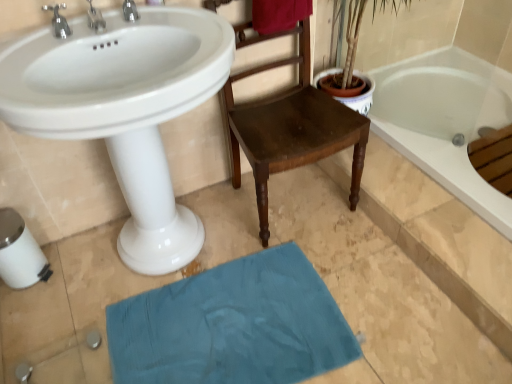
Question: Does silver metallic faucet at upper left, the second tap from the left, lie in front of teal fabric bath mat at lower center?

Choices:
 (A) no
 (B) yes

Answer: (B)

Question: Is silver metallic faucet at upper left, the second tap in the right-to-left sequence, aimed at teal fabric bath mat at lower center?

Choices:
 (A) no
 (B) yes

Answer: (A)

Question: Does silver metallic faucet at upper left, the second tap in the right-to-left sequence, touch teal fabric bath mat at lower center?

Choices:
 (A) no
 (B) yes

Answer: (A)

Question: Is silver metallic faucet at upper left, the second tap in the right-to-left sequence, positioned behind teal fabric bath mat at lower center?

Choices:
 (A) yes
 (B) no

Answer: (B)

Question: From a real-world perspective, is silver metallic faucet at upper left, the second tap from the left, positioned over teal fabric bath mat at lower center based on gravity?

Choices:
 (A) yes
 (B) no

Answer: (A)

Question: Visually, is white plastic toilet paper at lower left positioned to the left or to the right of teal fabric bath mat at lower center?

Choices:
 (A) right
 (B) left

Answer: (B)

Question: From their relative heights in the image, would you say white plastic toilet paper at lower left is taller or shorter than teal fabric bath mat at lower center?

Choices:
 (A) tall
 (B) short

Answer: (A)

Question: In terms of width, does white plastic toilet paper at lower left look wider or thinner when compared to teal fabric bath mat at lower center?

Choices:
 (A) wide
 (B) thin

Answer: (B)

Question: Choose the correct answer: Is white plastic toilet paper at lower left inside teal fabric bath mat at lower center or outside it?

Choices:
 (A) outside
 (B) inside

Answer: (A)

Question: Considering the positions of teal fabric bath mat at lower center and velvet red towel at upper center in the image, is teal fabric bath mat at lower center bigger or smaller than velvet red towel at upper center?

Choices:
 (A) small
 (B) big

Answer: (B)

Question: From the image's perspective, is teal fabric bath mat at lower center located above or below velvet red towel at upper center?

Choices:
 (A) below
 (B) above

Answer: (A)

Question: Considering their positions, is teal fabric bath mat at lower center located in front of or behind velvet red towel at upper center?

Choices:
 (A) front
 (B) behind

Answer: (A)

Question: Is teal fabric bath mat at lower center inside the boundaries of velvet red towel at upper center, or outside?

Choices:
 (A) outside
 (B) inside

Answer: (A)

Question: Does point [x=145, y=183] appear closer or farther from the camera than point [x=329, y=135]?

Choices:
 (A) farther
 (B) closer

Answer: (B)

Question: Is white glossy sink at upper left inside or outside of wooden chair at center?

Choices:
 (A) outside
 (B) inside

Answer: (A)